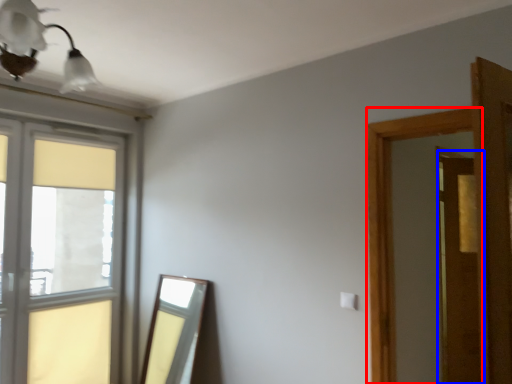
Question: Which object is closer to the camera taking this photo, window frame (highlighted by a red box) or screen door (highlighted by a blue box)?

Choices:
 (A) window frame
 (B) screen door

Answer: (A)